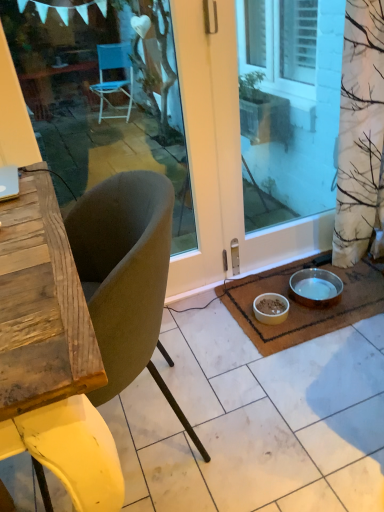
Question: Based on their sizes in the image, would you say velvet-like beige chair at center is bigger or smaller than transparent glass door at center, the first window screen positioned from the right?

Choices:
 (A) big
 (B) small

Answer: (A)

Question: From a real-world perspective, is velvet-like beige chair at center physically located above or below transparent glass door at center, the second window screen in the left-to-right sequence?

Choices:
 (A) above
 (B) below

Answer: (B)

Question: Which is nearer to the transparent glass door at center, the second window screen in the left-to-right sequence?

Choices:
 (A) white matte bowl at lower center, the first bowl viewed from the left
 (B) velvet-like beige chair at center
 (C) metallic silver bowl at lower right, the first bowl viewed from the right
 (D) brown woven mat at lower right
 (E) transparent glass door at center, the second window screen in the right-to-left sequence

Answer: (D)

Question: Considering the real-world distances, which object is farthest from the transparent glass door at center, the second window screen in the left-to-right sequence?

Choices:
 (A) white matte bowl at lower center, positioned as the second bowl in right-to-left order
 (B) metallic silver bowl at lower right, the first bowl viewed from the right
 (C) brown woven mat at lower right
 (D) transparent glass door at center, the second window screen in the right-to-left sequence
 (E) velvet-like beige chair at center

Answer: (D)